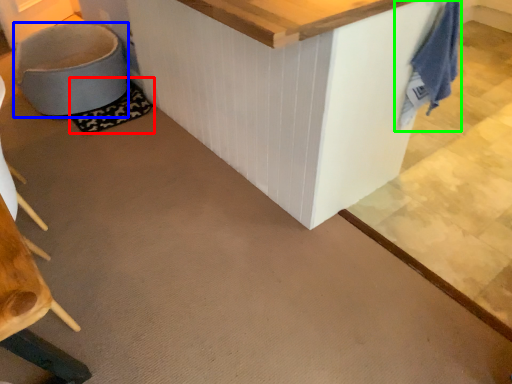
Question: Which object is positioned closest to mat (highlighted by a red box)? Select from swivel chair (highlighted by a blue box) and laundry (highlighted by a green box).

Choices:
 (A) swivel chair
 (B) laundry

Answer: (A)